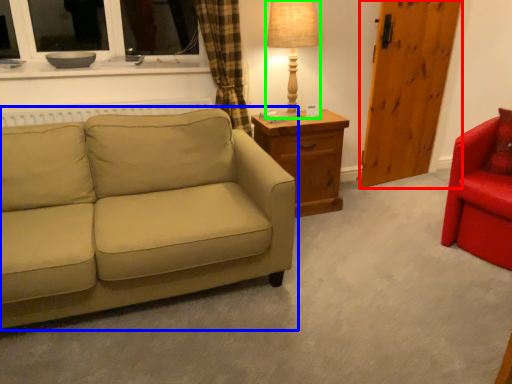
Question: Based on their relative distances, which object is farther from barn door (highlighted by a red box)? Choose from studio couch (highlighted by a blue box) and table lamp (highlighted by a green box).

Choices:
 (A) studio couch
 (B) table lamp

Answer: (A)